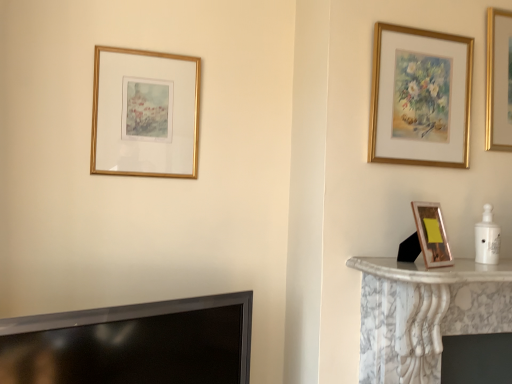
Describe the element at coordinates (145, 113) in the screenshot. This screenshot has height=384, width=512. I see `gold-framed picture at upper left, which is the first picture frame in left-to-right order` at that location.

Measure the distance between point [430,260] and camera.

They are 4.29 feet apart.

Identify the location of gold-framed picture at upper left, which is the first picture frame in left-to-right order. (145, 113).

Is point (173, 158) closer or farther from the camera than point (426, 204)?

Point (173, 158) is farther from the camera than point (426, 204).

From the picture: Does gold-framed picture at upper left, the third picture frame positioned from the front, have a lesser height compared to gold metallic picture frame at right, the 3th picture frame positioned from the back?

Incorrect, the height of gold-framed picture at upper left, the third picture frame positioned from the front, does not fall short of that of gold metallic picture frame at right, the 3th picture frame positioned from the back.

From a real-world perspective, is gold-framed picture at upper left, marked as the third picture frame in a right-to-left arrangement, positioned above or below gold metallic picture frame at right, the second picture frame from the right?

From a real-world perspective, gold-framed picture at upper left, marked as the third picture frame in a right-to-left arrangement, is physically above gold metallic picture frame at right, the second picture frame from the right.

From the image's perspective, is gold-framed picture at upper left, marked as the first picture frame in a back-to-front arrangement, on gold metallic picture frame at right, which ranks as the 2th picture frame in left-to-right order?

Correct, gold-framed picture at upper left, marked as the first picture frame in a back-to-front arrangement, appears higher than gold metallic picture frame at right, which ranks as the 2th picture frame in left-to-right order, in the image.

Would you say black glossy tv at lower left is part of gold metallic picture frame at right, which ranks as the 2th picture frame in left-to-right order,'s contents?

No, black glossy tv at lower left is located outside of gold metallic picture frame at right, which ranks as the 2th picture frame in left-to-right order.

Is gold metallic picture frame at right, which is counted as the 1th picture frame, starting from the front, aimed at black glossy tv at lower left?

No.

From the image's perspective, does gold metallic picture frame at right, the second picture frame from the right, appear higher than black glossy tv at lower left?

Correct, gold metallic picture frame at right, the second picture frame from the right, appears higher than black glossy tv at lower left in the image.

Would you say gold metallic picture frame at right, which is counted as the 1th picture frame, starting from the front, is to the left or to the right of black glossy tv at lower left in the picture?

In the image, gold metallic picture frame at right, which is counted as the 1th picture frame, starting from the front, appears on the right side of black glossy tv at lower left.

Looking at the image, does gold metallic picture frame at right, which ranks as the 2th picture frame in left-to-right order, seem bigger or smaller compared to gold-framed painting at upper right, which ranks as the second picture frame in back-to-front order?

Clearly, gold metallic picture frame at right, which ranks as the 2th picture frame in left-to-right order, is smaller in size than gold-framed painting at upper right, which ranks as the second picture frame in back-to-front order.

Is gold metallic picture frame at right, which is counted as the 1th picture frame, starting from the front, facing towards gold-framed painting at upper right, which is counted as the 2th picture frame, starting from the front?

No, gold metallic picture frame at right, which is counted as the 1th picture frame, starting from the front, is not turned towards gold-framed painting at upper right, which is counted as the 2th picture frame, starting from the front.

Is gold metallic picture frame at right, the 3th picture frame positioned from the back, far from gold-framed painting at upper right, the 3th picture frame in the left-to-right sequence?

Actually, gold metallic picture frame at right, the 3th picture frame positioned from the back, and gold-framed painting at upper right, the 3th picture frame in the left-to-right sequence, are a little close together.

Can you tell me how much gold metallic picture frame at right, which is counted as the 1th picture frame, starting from the front, and gold-framed painting at upper right, which appears as the first picture frame when viewed from the right, differ in facing direction?

The angular difference between gold metallic picture frame at right, which is counted as the 1th picture frame, starting from the front, and gold-framed painting at upper right, which appears as the first picture frame when viewed from the right, is 23.6 degrees.

Is black glossy tv at lower left to the left of gold-framed picture at upper left, which is the first picture frame in left-to-right order, from the viewer's perspective?

No, black glossy tv at lower left is not to the left of gold-framed picture at upper left, which is the first picture frame in left-to-right order.

From a real-world perspective, is black glossy tv at lower left positioned over gold-framed picture at upper left, which is the first picture frame in left-to-right order, based on gravity?

No, from a real-world perspective, black glossy tv at lower left is not on top of gold-framed picture at upper left, which is the first picture frame in left-to-right order.

From the image's perspective, which one is positioned lower, black glossy tv at lower left or gold-framed picture at upper left, the third picture frame positioned from the front?

From the image's view, black glossy tv at lower left is below.

Which of these two, black glossy tv at lower left or gold-framed picture at upper left, marked as the third picture frame in a right-to-left arrangement, stands taller?

With more height is gold-framed picture at upper left, marked as the third picture frame in a right-to-left arrangement.

Are gold metallic picture frame at right, the second picture frame from the right, and gold-framed picture at upper left, which is the first picture frame in left-to-right order, making contact?

No, gold metallic picture frame at right, the second picture frame from the right, is not making contact with gold-framed picture at upper left, which is the first picture frame in left-to-right order.

At what (x,y) coordinates should I click in order to perform the action: click on the 1st picture frame positioned above the gold metallic picture frame at right, which ranks as the 2th picture frame in left-to-right order (from a real-world perspective). Please return your answer as a coordinate pair (x, y). Looking at the image, I should click on 145,113.

From the image's perspective, would you say gold metallic picture frame at right, the second picture frame from the right, is shown under gold-framed picture at upper left, the third picture frame positioned from the front?

Correct, gold metallic picture frame at right, the second picture frame from the right, appears lower than gold-framed picture at upper left, the third picture frame positioned from the front, in the image.

Based on the photo, which is nearer, (445, 241) or (169, 106)?

Point (445, 241) appears to be closer to the viewer than point (169, 106).

Which point is more distant from viewer, (451,75) or (433,244)?

The point (451,75) is behind.

Where is `picture frame in front of the gold-framed painting at upper right, which is counted as the 2th picture frame, starting from the front`? This screenshot has height=384, width=512. picture frame in front of the gold-framed painting at upper right, which is counted as the 2th picture frame, starting from the front is located at coordinates (432, 234).

Based on the photo, what's the angular difference between gold-framed painting at upper right, which is counted as the 2th picture frame, starting from the front, and gold metallic picture frame at right, the 3th picture frame positioned from the back,'s facing directions?

23.6 degrees separate the facing orientations of gold-framed painting at upper right, which is counted as the 2th picture frame, starting from the front, and gold metallic picture frame at right, the 3th picture frame positioned from the back.

How much distance is there between gold-framed painting at upper right, which is counted as the 2th picture frame, starting from the front, and gold metallic picture frame at right, which is counted as the 1th picture frame, starting from the front?

A distance of 15.39 inches exists between gold-framed painting at upper right, which is counted as the 2th picture frame, starting from the front, and gold metallic picture frame at right, which is counted as the 1th picture frame, starting from the front.

Between gold-framed picture at upper left, marked as the third picture frame in a right-to-left arrangement, and black glossy tv at lower left, which one has smaller width?

gold-framed picture at upper left, marked as the third picture frame in a right-to-left arrangement.

From a real-world perspective, which is physically below, gold-framed picture at upper left, which is the first picture frame in left-to-right order, or black glossy tv at lower left?

In real-world perspective, black glossy tv at lower left is lower.

Is gold-framed picture at upper left, marked as the first picture frame in a back-to-front arrangement, completely or partially outside of black glossy tv at lower left?

gold-framed picture at upper left, marked as the first picture frame in a back-to-front arrangement, is positioned outside black glossy tv at lower left.

Could you tell me if gold-framed picture at upper left, marked as the third picture frame in a right-to-left arrangement, is facing black glossy tv at lower left?

No, gold-framed picture at upper left, marked as the third picture frame in a right-to-left arrangement, does not turn towards black glossy tv at lower left.

Starting from the gold metallic picture frame at right, the 3th picture frame positioned from the back, which picture frame is the 2nd one behind? Please provide its 2D coordinates.

[(145, 113)]

From the image's perspective, starting from the black glossy tv at lower left, which picture frame is the 1st one above? Please provide its 2D coordinates.

[(432, 234)]

Based on their spatial positions, is gold metallic picture frame at right, which ranks as the 2th picture frame in left-to-right order, or gold-framed painting at upper right, the 3th picture frame in the left-to-right sequence, further from black glossy tv at lower left?

Among the two, gold-framed painting at upper right, the 3th picture frame in the left-to-right sequence, is located further to black glossy tv at lower left.

Looking at the image, which one is located closer to black glossy tv at lower left, gold-framed painting at upper right, which ranks as the second picture frame in back-to-front order, or gold-framed picture at upper left, marked as the first picture frame in a back-to-front arrangement?

gold-framed picture at upper left, marked as the first picture frame in a back-to-front arrangement, is positioned closer to the anchor black glossy tv at lower left.

From the image, which object appears to be farther from gold-framed picture at upper left, marked as the third picture frame in a right-to-left arrangement, gold-framed painting at upper right, which is counted as the 2th picture frame, starting from the front, or gold metallic picture frame at right, which is counted as the 1th picture frame, starting from the front?

Based on the image, gold metallic picture frame at right, which is counted as the 1th picture frame, starting from the front, appears to be further to gold-framed picture at upper left, marked as the third picture frame in a right-to-left arrangement.

Consider the image. From the image, which object appears to be farther from gold-framed picture at upper left, marked as the first picture frame in a back-to-front arrangement, black glossy tv at lower left or gold metallic picture frame at right, the second picture frame from the right?

gold metallic picture frame at right, the second picture frame from the right, is further to gold-framed picture at upper left, marked as the first picture frame in a back-to-front arrangement.

When comparing their distances from gold-framed painting at upper right, which ranks as the second picture frame in back-to-front order, does gold metallic picture frame at right, the second picture frame from the right, or black glossy tv at lower left seem further?

The object further to gold-framed painting at upper right, which ranks as the second picture frame in back-to-front order, is black glossy tv at lower left.

When comparing their distances from black glossy tv at lower left, does gold-framed picture at upper left, marked as the first picture frame in a back-to-front arrangement, or gold-framed painting at upper right, which appears as the first picture frame when viewed from the right, seem closer?

The object closer to black glossy tv at lower left is gold-framed picture at upper left, marked as the first picture frame in a back-to-front arrangement.

From the image, which object appears to be farther from gold metallic picture frame at right, the second picture frame from the right, black glossy tv at lower left or gold-framed painting at upper right, which is counted as the 2th picture frame, starting from the front?

Based on the image, black glossy tv at lower left appears to be further to gold metallic picture frame at right, the second picture frame from the right.

Looking at the image, which one is located closer to gold metallic picture frame at right, the second picture frame from the right, gold-framed picture at upper left, the third picture frame positioned from the front, or gold-framed painting at upper right, which appears as the first picture frame when viewed from the right?

gold-framed painting at upper right, which appears as the first picture frame when viewed from the right.

I want to click on television located between gold-framed picture at upper left, marked as the third picture frame in a right-to-left arrangement, and gold-framed painting at upper right, which appears as the first picture frame when viewed from the right, in the left-right direction, so click(x=133, y=343).

The image size is (512, 384). I want to click on television situated between gold-framed picture at upper left, the third picture frame positioned from the front, and gold metallic picture frame at right, the second picture frame from the right, from left to right, so click(x=133, y=343).

Where is `picture frame between black glossy tv at lower left and gold-framed painting at upper right, the 3th picture frame in the left-to-right sequence`? picture frame between black glossy tv at lower left and gold-framed painting at upper right, the 3th picture frame in the left-to-right sequence is located at coordinates (432, 234).

You are a GUI agent. You are given a task and a screenshot of the screen. Output one action in this format:
    pyautogui.click(x=<x>, y=<y>)
    Task: Click on the picture frame located between gold-framed picture at upper left, marked as the third picture frame in a right-to-left arrangement, and gold-framed painting at upper right, which ranks as the second picture frame in back-to-front order, in the left-right direction
    The image size is (512, 384).
    Given the screenshot: What is the action you would take?
    pyautogui.click(x=432, y=234)